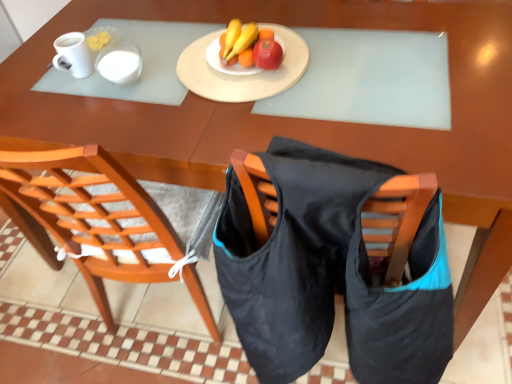
You are a GUI agent. You are given a task and a screenshot of the screen. Output one action in this format:
    pyautogui.click(x=<x>, y=<y>)
    Task: Click on the vacant space behind white glossy mug at upper left
    
    Given the screenshot: What is the action you would take?
    pyautogui.click(x=94, y=26)